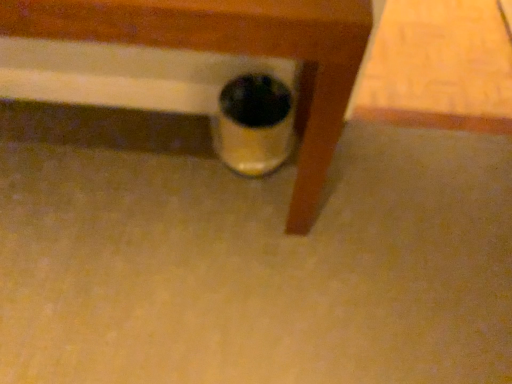
The height and width of the screenshot is (384, 512). Describe the element at coordinates (234, 52) in the screenshot. I see `wooden table at lower center` at that location.

This screenshot has width=512, height=384. Identify the location of wooden table at lower center. (234, 52).

The image size is (512, 384). Find the location of `wooden table at lower center`. wooden table at lower center is located at coordinates (234, 52).